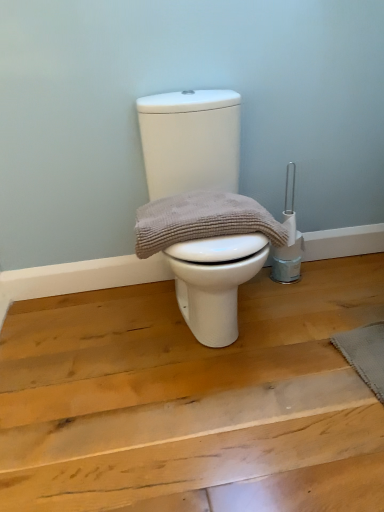
Describe the element at coordinates (190, 141) in the screenshot. I see `white matte toilet at center` at that location.

Locate an element on the screen. white matte toilet at center is located at coordinates (190, 141).

Based on the photo, in order to face gray textured mat at lower right, should I rotate leftwards or rightwards?

You should rotate right by 24.501 degrees.

Locate an element on the screen. The image size is (384, 512). beige textured towel at center is located at coordinates (202, 220).

The image size is (384, 512). I want to click on toilet below the beige textured towel at center (from a real-world perspective), so click(190, 141).

Looking at this image, does beige textured towel at center have a smaller size compared to white matte toilet at center?

Yes.

Is beige textured towel at center to the left or to the right of white matte toilet at center in the image?

Based on their positions, beige textured towel at center is located to the left of white matte toilet at center.

Considering the sizes of beige textured towel at center and white matte toilet at center in the image, is beige textured towel at center wider or thinner than white matte toilet at center?

beige textured towel at center is thinner than white matte toilet at center.

Which is correct: white matte toilet at center is inside gray textured mat at lower right, or outside of it?

The correct answer is: outside.

From a real-world perspective, between white matte toilet at center and gray textured mat at lower right, who is vertically lower?

gray textured mat at lower right is physically lower.

From the picture: Is white matte toilet at center in front of or behind gray textured mat at lower right in the image?

white matte toilet at center is in front of gray textured mat at lower right.

From their relative heights in the image, would you say white matte toilet at center is taller or shorter than gray textured mat at lower right?

Clearly, white matte toilet at center is taller compared to gray textured mat at lower right.

Considering the points (337, 345) and (152, 248), which point is behind, point (337, 345) or point (152, 248)?

The point (337, 345) is farther from the camera.

Which object is closer to the camera, gray textured mat at lower right or beige textured towel at center?

beige textured towel at center.

Which object is positioned more to the right, gray textured mat at lower right or beige textured towel at center?

Positioned to the right is gray textured mat at lower right.

From the image's perspective, relative to beige textured towel at center, is gray textured mat at lower right above or below?

From the image's perspective, gray textured mat at lower right appears below beige textured towel at center.

Does beige textured towel at center appear on the right side of gray textured mat at lower right?

No.

Considering the positions of points (160, 201) and (363, 346), is point (160, 201) closer to camera compared to point (363, 346)?

That is False.

Who is bigger, beige textured towel at center or gray textured mat at lower right?

beige textured towel at center is bigger.

Can you confirm if gray textured mat at lower right is wider than white matte toilet at center?

Incorrect, the width of gray textured mat at lower right does not surpass that of white matte toilet at center.

Does point (365, 352) lie behind point (215, 284)?

Yes, it is.

Are gray textured mat at lower right and white matte toilet at center located far from each other?

gray textured mat at lower right is actually quite close to white matte toilet at center.

From a real-world perspective, between gray textured mat at lower right and white matte toilet at center, who is vertically lower?

From a 3D spatial view, gray textured mat at lower right is below.

Is white matte toilet at center not inside beige textured towel at center?

Yes, white matte toilet at center is located beyond the bounds of beige textured towel at center.

In terms of width, does white matte toilet at center look wider or thinner when compared to beige textured towel at center?

In the image, white matte toilet at center appears to be wider than beige textured towel at center.

From a real-world perspective, which object rests below the other?

white matte toilet at center.

Does white matte toilet at center come in front of beige textured towel at center?

Yes, the depth of white matte toilet at center is less than that of beige textured towel at center.

Find the location of a particular element. material that is above the white matte toilet at center (from a real-world perspective) is located at coordinates (202, 220).

Where is `toilet lying above the gray textured mat at lower right (from the image's perspective)`? toilet lying above the gray textured mat at lower right (from the image's perspective) is located at coordinates (190, 141).

Looking at the image, which one is located further to white matte toilet at center, beige textured towel at center or gray textured mat at lower right?

Among the two, gray textured mat at lower right is located further to white matte toilet at center.

Based on their spatial positions, is white matte toilet at center or beige textured towel at center further from gray textured mat at lower right?

white matte toilet at center lies further to gray textured mat at lower right than the other object.

Looking at this image, looking at the image, which one is located closer to beige textured towel at center, gray textured mat at lower right or white matte toilet at center?

white matte toilet at center lies closer to beige textured towel at center than the other object.

Looking at the image, which one is located further to white matte toilet at center, gray textured mat at lower right or beige textured towel at center?

Based on the image, gray textured mat at lower right appears to be further to white matte toilet at center.

Considering their positions, is white matte toilet at center positioned closer to beige textured towel at center than gray textured mat at lower right?

white matte toilet at center lies closer to beige textured towel at center than the other object.

Estimate the real-world distances between objects in this image. Which object is further from gray textured mat at lower right, beige textured towel at center or white matte toilet at center?

white matte toilet at center lies further to gray textured mat at lower right than the other object.

The width and height of the screenshot is (384, 512). I want to click on toilet between beige textured towel at center and gray textured mat at lower right from left to right, so click(190, 141).